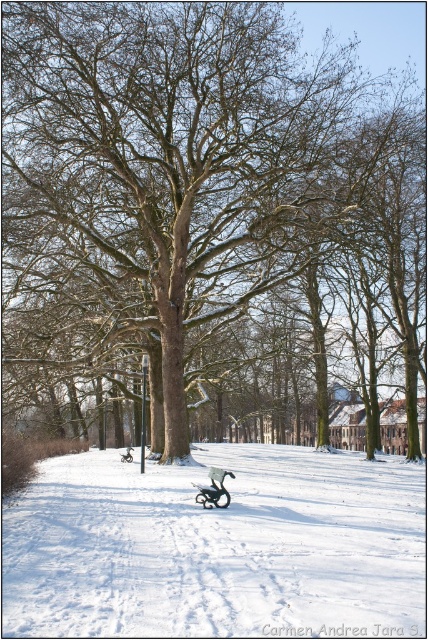
Is white fluffy snow at center smaller than metallic silver sleigh at center?

No.

Who is higher up, white fluffy snow at center or metallic silver sleigh at center?

Positioned higher is metallic silver sleigh at center.

What do you see at coordinates (216, 547) in the screenshot?
I see `white fluffy snow at center` at bounding box center [216, 547].

Image resolution: width=428 pixels, height=640 pixels. Identify the location of white fluffy snow at center. (216, 547).

Is point (68, 211) positioned before point (222, 504)?

No, it is behind (222, 504).

Is brown rough tree at center smaller than metallic silver sleigh at center?

No.

Is point (288, 288) closer to viewer compared to point (199, 500)?

No, (288, 288) is further to viewer.

Image resolution: width=428 pixels, height=640 pixels. I want to click on brown rough tree at center, so click(x=210, y=212).

Measure the distance between point (121, 378) and camera.

Point (121, 378) is 43.72 meters from camera.

Locate an element on the screen. This screenshot has width=428, height=640. brown rough tree at center is located at coordinates (210, 212).

Identify the location of brown rough tree at center. (210, 212).